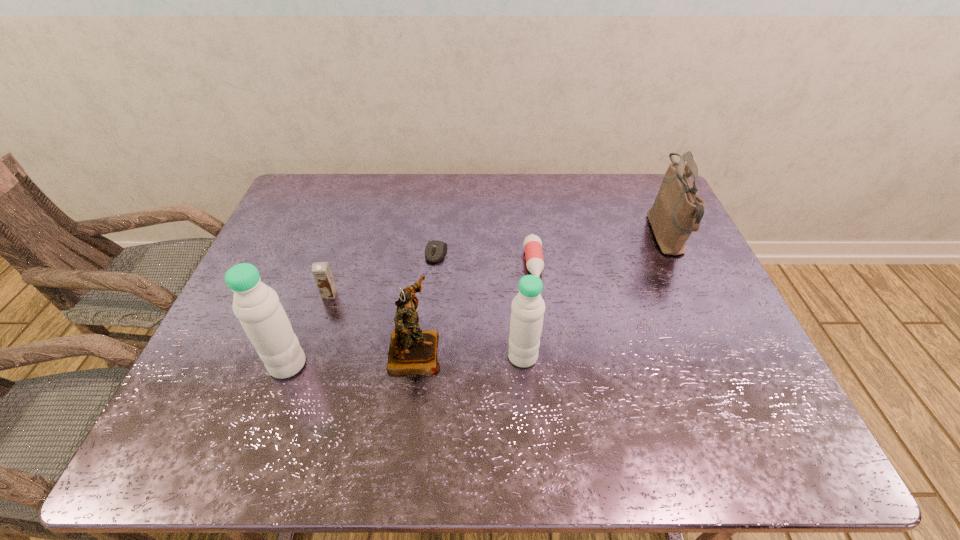
Find the location of a particular element. This screenshot has width=960, height=540. the left water bottle is located at coordinates (256, 305).

Locate an element on the screen. the right water bottle is located at coordinates (528, 307).

Where is `computer equipment`? This screenshot has height=540, width=960. computer equipment is located at coordinates (435, 250).

You are a GUI agent. You are given a task and a screenshot of the screen. Output one action in this format:
    pyautogui.click(x=<x>, y=<y>)
    Task: Click on the shoulder bag
    The width and height of the screenshot is (960, 540).
    Given the screenshot: What is the action you would take?
    (x=677, y=211)

Where is `the sixth tallest object`? The image size is (960, 540). the sixth tallest object is located at coordinates (532, 244).

Identify the location of figurine. click(x=412, y=351).

The height and width of the screenshot is (540, 960). Find the location of `the fifth tallest object`. the fifth tallest object is located at coordinates (321, 271).

Identify the location of chocolate milk. (321, 271).

You are a GUI agent. You are given a task and a screenshot of the screen. Output one action in this format:
    pyautogui.click(x=<x>, y=<y>)
    Task: Click on the vacant point located 0.370m on the right of the taller water bottle
    The width and height of the screenshot is (960, 540).
    Given the screenshot: What is the action you would take?
    pyautogui.click(x=467, y=364)

In order to click on vacant space situated 0.210m on the left of the shorter water bottle in this screenshot , I will do `click(418, 356)`.